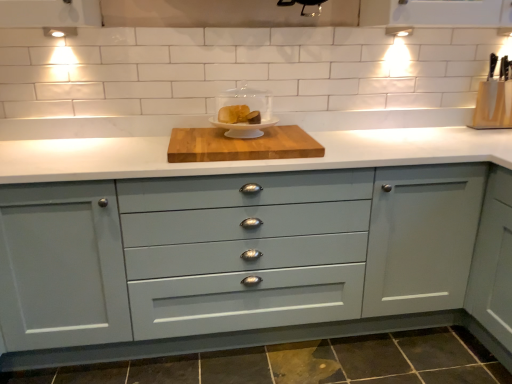
Question: Relative to matte white cake stand at center, the 2th appliance from the back, is wooden knife block at upper right, positioned as the 2th appliance in left-to-right order, in front or behind?

Choices:
 (A) behind
 (B) front

Answer: (A)

Question: Is wooden knife block at upper right, marked as the 1th appliance in a back-to-front arrangement, taller or shorter than matte white cake stand at center, which appears as the first appliance when viewed from the front?

Choices:
 (A) short
 (B) tall

Answer: (B)

Question: Estimate the real-world distances between objects in this image. Which object is farther from the matte gray cabinet at center?

Choices:
 (A) wooden cutting board at center
 (B) wooden knife block at upper right, positioned as the 2th appliance in left-to-right order
 (C) matte white cake stand at center, which appears as the 1th appliance when viewed from the left

Answer: (B)

Question: Which object is the closest to the wooden knife block at upper right, which is counted as the second appliance, starting from the front?

Choices:
 (A) wooden cutting board at center
 (B) matte gray cabinet at center
 (C) matte white cake stand at center, which appears as the first appliance when viewed from the front

Answer: (B)